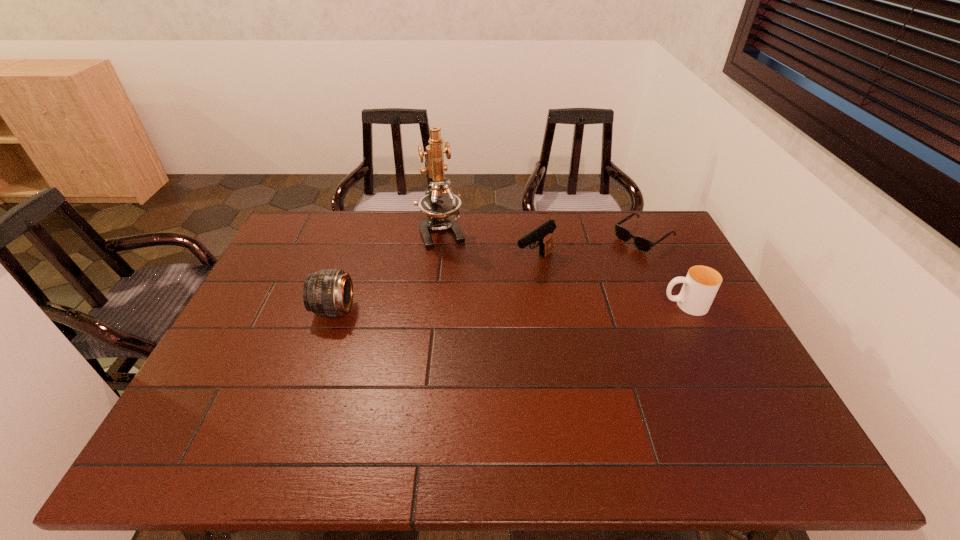
The height and width of the screenshot is (540, 960). Find the location of `free space located with the handle on the side of the fourth tallest object`. free space located with the handle on the side of the fourth tallest object is located at coordinates (561, 305).

The width and height of the screenshot is (960, 540). Find the location of `vacant space positioned with the handle on the side of the fourth tallest object`. vacant space positioned with the handle on the side of the fourth tallest object is located at coordinates (627, 305).

In order to click on free spot located 0.390m at the front lenses of the shortest object in this screenshot , I will do `click(546, 303)`.

Where is `free space located 0.090m at the front lenses of the shortest object`? Image resolution: width=960 pixels, height=540 pixels. free space located 0.090m at the front lenses of the shortest object is located at coordinates (610, 260).

Identify the location of vacant region located 0.380m at the front lenses of the shortest object. The image size is (960, 540). (549, 301).

Where is `blank area located 0.130m at the barrel of the third object from right to left`? The width and height of the screenshot is (960, 540). blank area located 0.130m at the barrel of the third object from right to left is located at coordinates (494, 291).

Where is `vacant space situated 0.050m at the barrel of the third object from right to left`? The image size is (960, 540). vacant space situated 0.050m at the barrel of the third object from right to left is located at coordinates (512, 278).

Find the location of `free space located at the barrel of the third object from right to left`. free space located at the barrel of the third object from right to left is located at coordinates (510, 280).

Identify the location of vacant position located at the eyepiece of the second object from left to right. (463, 287).

At what (x,y) coordinates should I click in order to perform the action: click on vacant space located 0.110m at the eyepiece of the second object from left to right. Please return your answer as a coordinate pair (x, y). The height and width of the screenshot is (540, 960). Looking at the image, I should click on (456, 271).